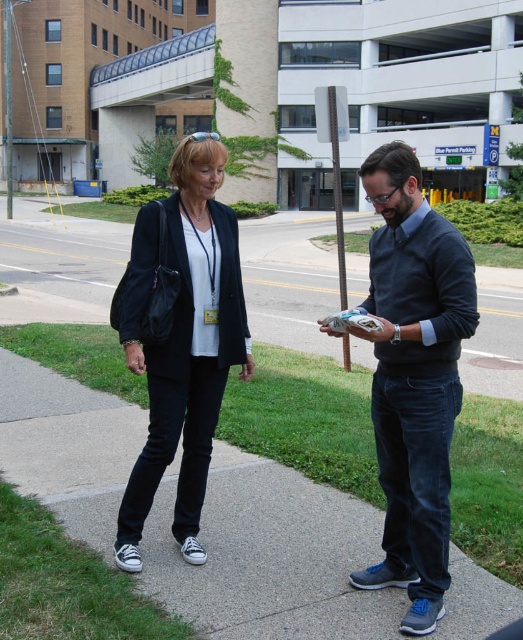
Question: Which point appears farthest from the camera in this image?

Choices:
 (A) (436, 433)
 (B) (230, 280)
 (C) (138, 460)

Answer: (C)

Question: Is dark blue sweater at center bigger than black canvas sneakers at lower left?

Choices:
 (A) no
 (B) yes

Answer: (B)

Question: Can you confirm if dark blue sweater at center is bigger than black canvas sneakers at lower left?

Choices:
 (A) no
 (B) yes

Answer: (B)

Question: Does dark blue jeans at center appear on the right side of dark blue sweater at center?

Choices:
 (A) yes
 (B) no

Answer: (B)

Question: Among these objects, which one is nearest to the camera?

Choices:
 (A) dark blue sweater at center
 (B) dark blue jeans at center

Answer: (B)

Question: Which point is farther from the camera taking this photo?

Choices:
 (A) (428, 384)
 (B) (126, 557)
 (C) (404, 508)

Answer: (B)